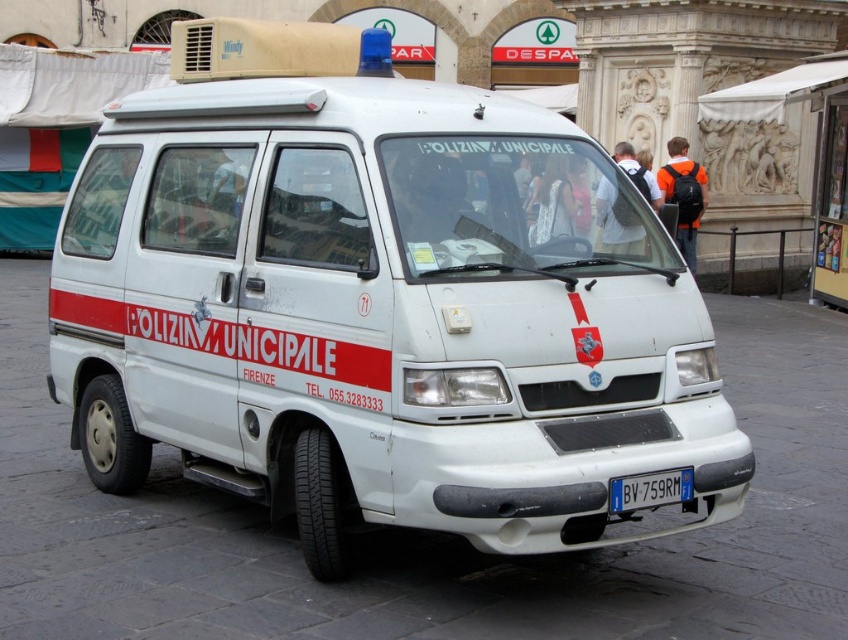
Does white matte van at center appear under blue metallic license plate at front?

No.

Is point (57, 266) farther from viewer compared to point (645, 481)?

Yes, point (57, 266) is farther from viewer.

Find the location of a particular element. Image resolution: width=848 pixels, height=640 pixels. white matte van at center is located at coordinates (377, 301).